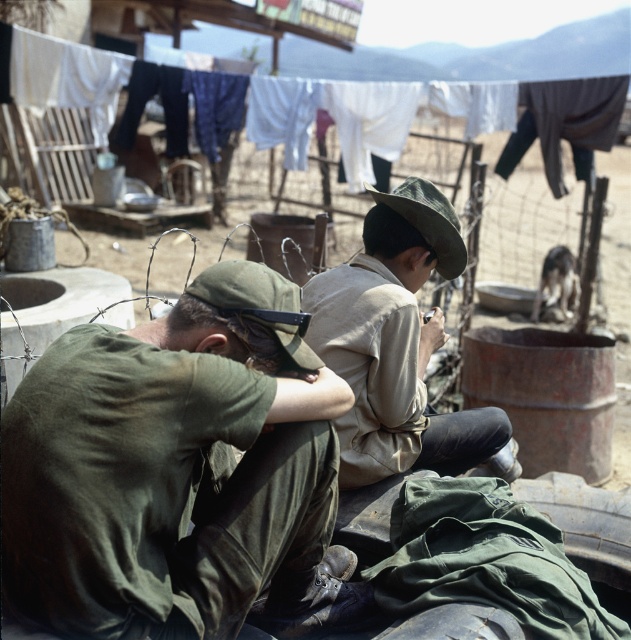
Question: Which object is closer to the camera taking this photo?

Choices:
 (A) white cotton clothes at upper center
 (B) green matte uniform at center

Answer: (B)

Question: Which point is closer to the camera?

Choices:
 (A) (408, 56)
 (B) (399, 352)
 (C) (225, 424)

Answer: (C)

Question: Can you confirm if khaki fabric hat at center is smaller than white cotton clothes at upper center?

Choices:
 (A) no
 (B) yes

Answer: (B)

Question: Is green matte uniform at center smaller than white cotton clothes at upper center?

Choices:
 (A) no
 (B) yes

Answer: (B)

Question: Estimate the real-world distances between objects in this image. Which object is farther from the green matte uniform at center?

Choices:
 (A) white cotton clothes at upper center
 (B) khaki fabric hat at center

Answer: (A)

Question: Is green matte uniform at center bigger than khaki fabric hat at center?

Choices:
 (A) no
 (B) yes

Answer: (A)